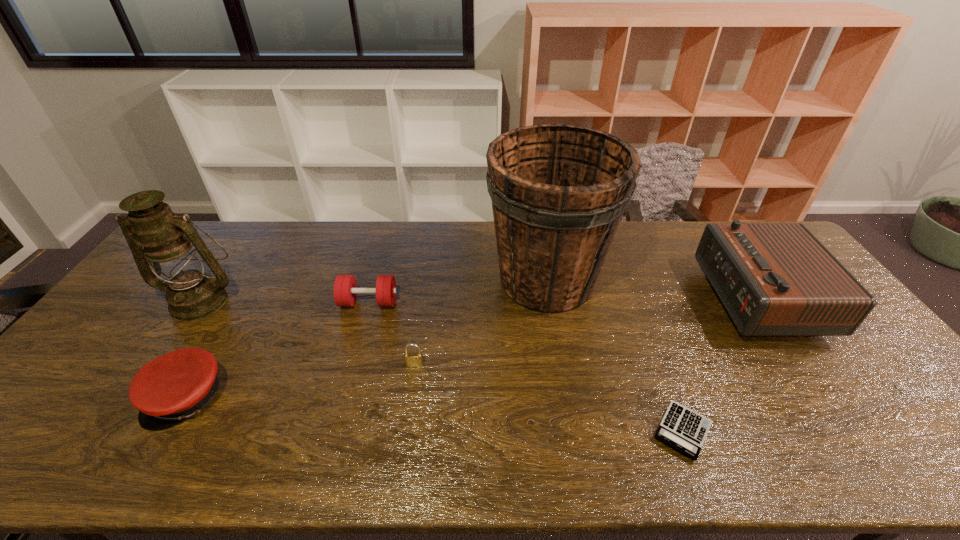
Locate an element on the screen. This screenshot has width=960, height=540. vacant space located 0.080m on the front of the second tallest object is located at coordinates (172, 343).

This screenshot has height=540, width=960. Find the location of `free space located 0.250m on the front panel of the rightmost object`. free space located 0.250m on the front panel of the rightmost object is located at coordinates (x=627, y=298).

The image size is (960, 540). I want to click on free space located 0.060m on the front panel of the rightmost object, so click(689, 298).

The width and height of the screenshot is (960, 540). In order to click on vacant region located 0.310m on the front panel of the rightmost object in this screenshot , I will do `click(608, 298)`.

Locate an element on the screen. This screenshot has width=960, height=540. blank space located on the left of the dumbbell is located at coordinates (290, 302).

You are a GUI agent. You are given a task and a screenshot of the screen. Output one action in this format:
    pyautogui.click(x=<x>, y=<y>)
    Task: Click on the free region located 0.050m at the front of the cap where the visor is located
    The width and height of the screenshot is (960, 540).
    Given the screenshot: What is the action you would take?
    pyautogui.click(x=156, y=453)

Image resolution: width=960 pixels, height=540 pixels. I want to click on blank space located on the front-facing side of the padlock, so tap(402, 451).

Locate an element on the screen. The width and height of the screenshot is (960, 540). free spot located on the right of the calculator is located at coordinates (842, 431).

Find the location of a particular element. The height and width of the screenshot is (540, 960). bucket situated at the far edge is located at coordinates (558, 191).

Find the location of a particular element. The width and height of the screenshot is (960, 540). radio receiver situated at the far edge is located at coordinates (774, 279).